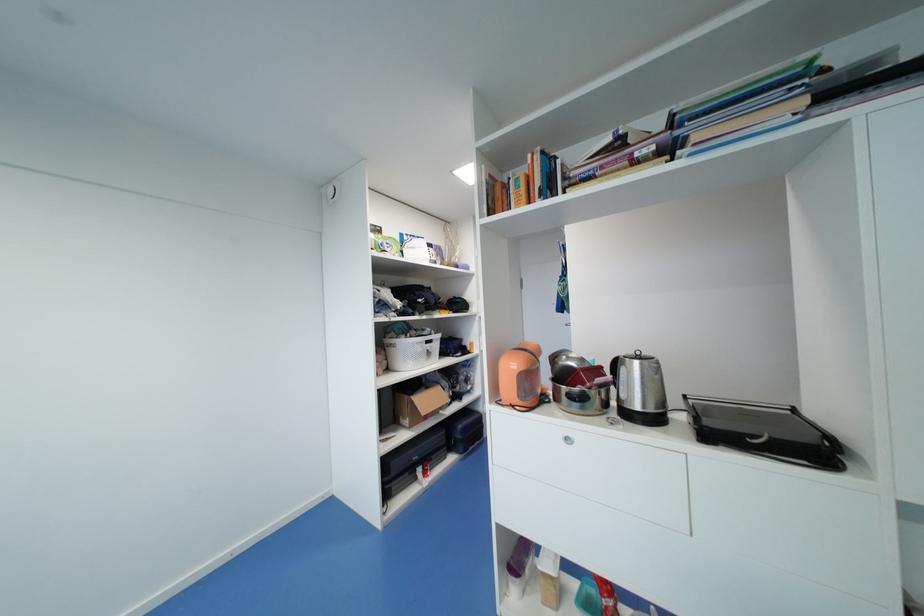
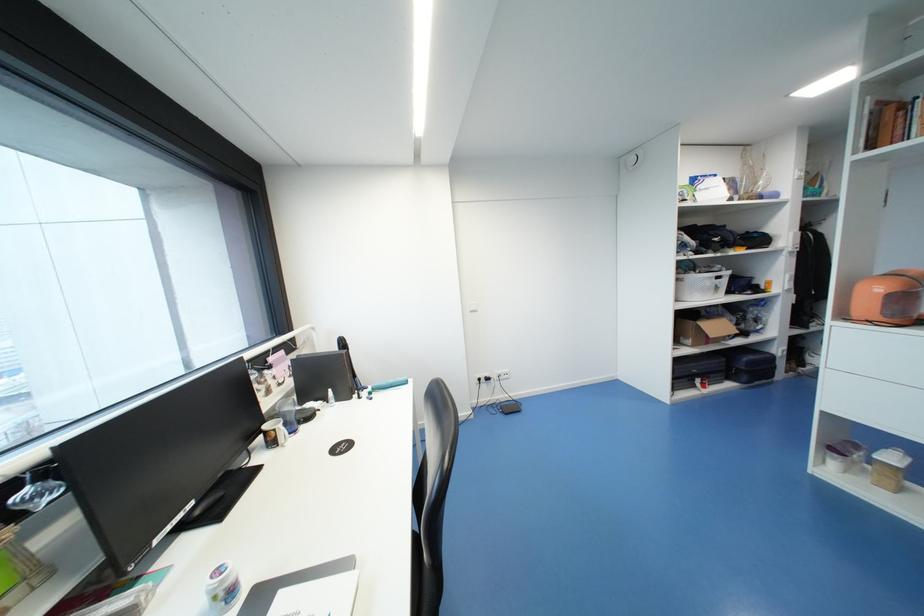
The point at (433,354) is marked in the first image. Where is the corresponding point in the second image?

(721, 288)